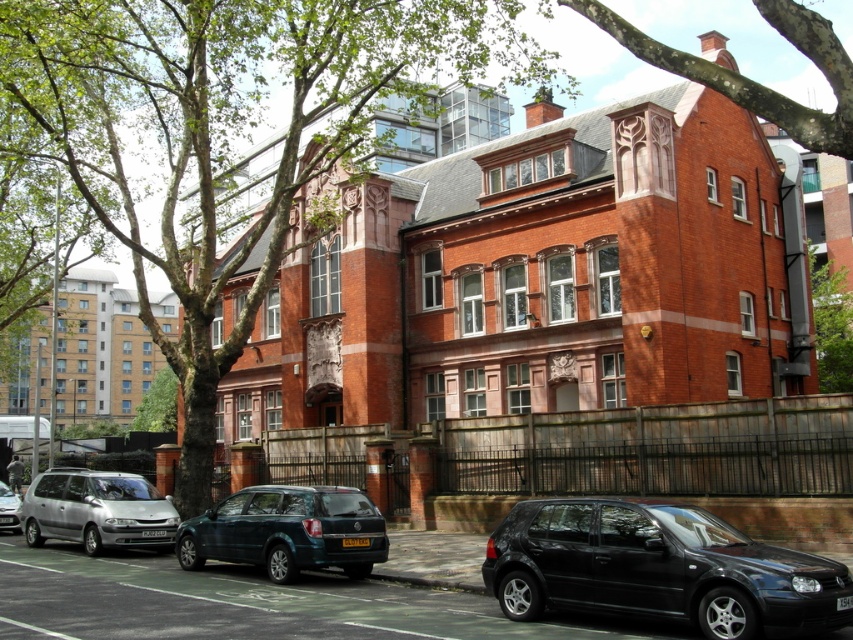
Question: Which object is the farthest from the silver metallic minivan at lower left?

Choices:
 (A) silver metallic van at lower left
 (B) metallic green suv at lower center

Answer: (B)

Question: Can you confirm if metallic green suv at lower center is smaller than silver metallic van at lower left?

Choices:
 (A) no
 (B) yes

Answer: (A)

Question: Which point is closer to the camera taking this photo?

Choices:
 (A) pos(190,173)
 (B) pos(601,3)

Answer: (B)

Question: Can you confirm if green leafy tree at upper left is positioned below silver metallic minivan at lower left?

Choices:
 (A) no
 (B) yes

Answer: (A)

Question: Can you confirm if green leafy tree at upper center is thinner than silver metallic van at lower left?

Choices:
 (A) yes
 (B) no

Answer: (B)

Question: Considering the real-world distances, which object is closest to the green leafy tree at upper right?

Choices:
 (A) silver metallic minivan at lower left
 (B) green leafy tree at upper left
 (C) black matte hatchback at lower right
 (D) green leafy tree at upper center

Answer: (D)